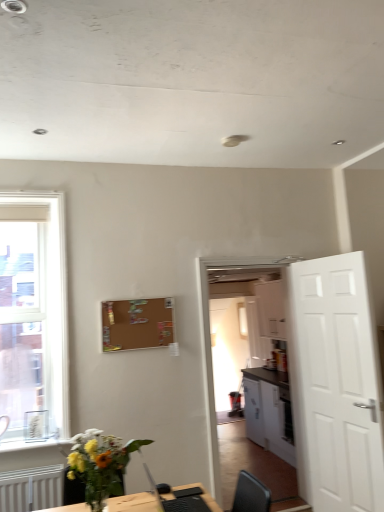
Question: Would you say white glossy cabinet at center contains translucent glass vase at lower left?

Choices:
 (A) no
 (B) yes

Answer: (A)

Question: Does white glossy cabinet at center have a lesser width compared to translucent glass vase at lower left?

Choices:
 (A) yes
 (B) no

Answer: (B)

Question: Is white glossy cabinet at center positioned before translucent glass vase at lower left?

Choices:
 (A) yes
 (B) no

Answer: (B)

Question: Is white glossy cabinet at center turned away from translucent glass vase at lower left?

Choices:
 (A) no
 (B) yes

Answer: (A)

Question: From a real-world perspective, is white glossy cabinet at center located beneath translucent glass vase at lower left?

Choices:
 (A) yes
 (B) no

Answer: (A)

Question: Based on their positions, is black plastic computer at lower center located to the left or right of translucent glass vase at lower left?

Choices:
 (A) right
 (B) left

Answer: (A)

Question: Is black plastic computer at lower center situated inside translucent glass vase at lower left or outside?

Choices:
 (A) inside
 (B) outside

Answer: (B)

Question: Is black plastic computer at lower center wider or thinner than translucent glass vase at lower left?

Choices:
 (A) wide
 (B) thin

Answer: (B)

Question: Considering the positions of black plastic computer at lower center and translucent glass vase at lower left in the image, is black plastic computer at lower center taller or shorter than translucent glass vase at lower left?

Choices:
 (A) short
 (B) tall

Answer: (A)

Question: From a real-world perspective, is white matte door at right positioned above or below black plastic computer at lower center?

Choices:
 (A) above
 (B) below

Answer: (A)

Question: From their relative heights in the image, would you say white matte door at right is taller or shorter than black plastic computer at lower center?

Choices:
 (A) tall
 (B) short

Answer: (A)

Question: Looking at their shapes, would you say white matte door at right is wider or thinner than black plastic computer at lower center?

Choices:
 (A) wide
 (B) thin

Answer: (B)

Question: Considering the relative positions of white matte door at right and black plastic computer at lower center in the image provided, is white matte door at right to the left or to the right of black plastic computer at lower center?

Choices:
 (A) right
 (B) left

Answer: (A)

Question: Considering the positions of white matte door at right and clear glass window at left in the image, is white matte door at right bigger or smaller than clear glass window at left?

Choices:
 (A) small
 (B) big

Answer: (B)

Question: Is point (327, 295) closer or farther from the camera than point (28, 355)?

Choices:
 (A) closer
 (B) farther

Answer: (A)